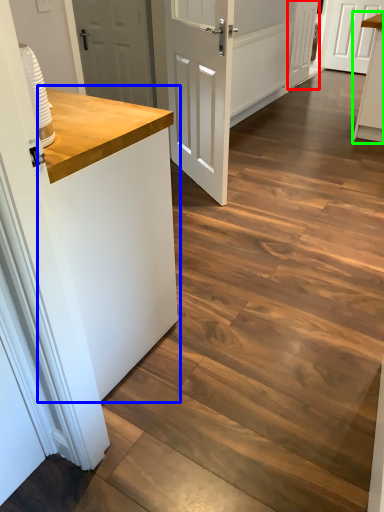
Question: Estimate the real-world distances between objects in this image. Which object is farther from door (highlighted by a red box), counter top (highlighted by a blue box) or cabinetry (highlighted by a green box)?

Choices:
 (A) counter top
 (B) cabinetry

Answer: (A)